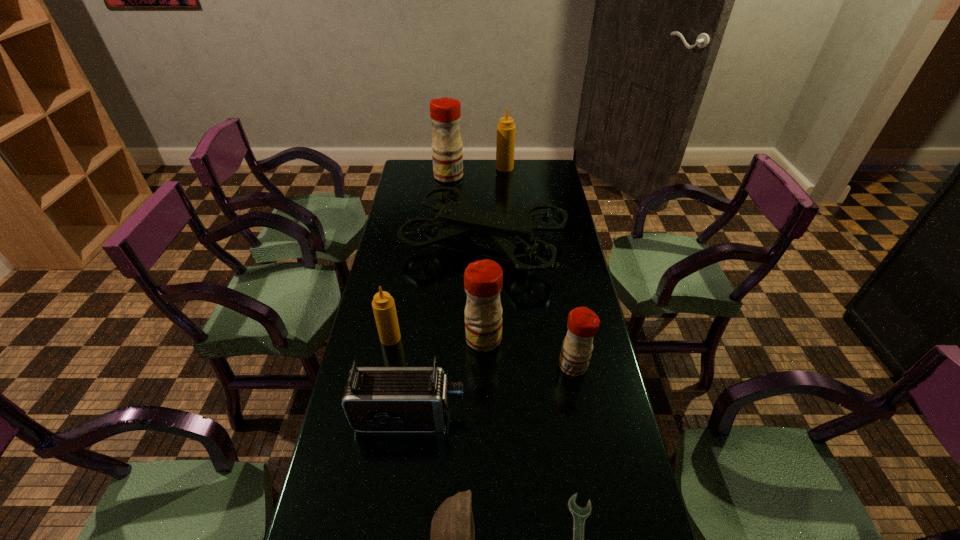
You are a GUI agent. You are given a task and a screenshot of the screen. Output one action in this format:
    pyautogui.click(x=<x>, y=<y>)
    Task: Click on the fourth nearest object
    This screenshot has width=960, height=540.
    Given the screenshot: What is the action you would take?
    pyautogui.click(x=583, y=323)

Where is `camcorder`? Image resolution: width=960 pixels, height=540 pixels. camcorder is located at coordinates (376, 399).

Identify the location of free region located on the right of the leftmost red condiment. (526, 176).

Image resolution: width=960 pixels, height=540 pixels. In order to click on vacant space positioned 0.080m on the back of the drone in this screenshot , I will do (x=484, y=197).

You are a GUI agent. You are given a task and a screenshot of the screen. Output one action in this format:
    pyautogui.click(x=<x>, y=<y>)
    Task: Click on the vacant space situated on the front of the fourth condiment from left to right
    This screenshot has height=540, width=960.
    Given the screenshot: What is the action you would take?
    pyautogui.click(x=507, y=190)

At what (x,y) coordinates should I click in order to perform the action: click on free point located on the left of the third condiment from right to left. Please return your answer as a coordinate pair (x, y). Image resolution: width=960 pixels, height=540 pixels. Looking at the image, I should click on (398, 339).

At what (x,y) coordinates should I click in order to perform the action: click on free space located 0.220m on the right of the leftmost condiment. Please return your answer as a coordinate pair (x, y). This screenshot has width=960, height=540. Looking at the image, I should click on (470, 338).

Locate an element on the screen. vacant space located 0.080m on the front of the nearest red condiment is located at coordinates (580, 402).

The height and width of the screenshot is (540, 960). What are the coordinates of `free space located at the lens of the camcorder` in the screenshot? It's located at (527, 417).

The width and height of the screenshot is (960, 540). I want to click on drone located in the left edge section of the desktop, so click(509, 231).